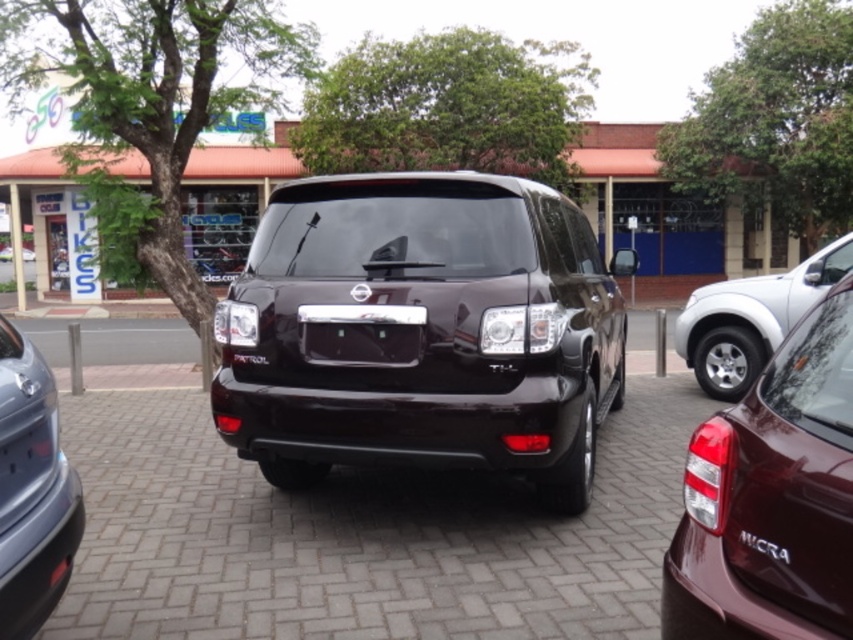
Question: Which point is farther to the camera?

Choices:
 (A) (64, 493)
 (B) (445, 456)
 (C) (802, 310)

Answer: (C)

Question: Which point is closer to the camera?

Choices:
 (A) (482, 394)
 (B) (828, 419)
 (C) (39, 596)
 (D) (815, 278)

Answer: (B)

Question: From the image, what is the correct spatial relationship of maroon glossy micra at lower right in relation to silver metallic pickup truck at right?

Choices:
 (A) above
 (B) below

Answer: (B)

Question: Which point is farther to the camera?

Choices:
 (A) maroon glossy micra at lower right
 (B) satin silver bumper at lower left

Answer: (B)

Question: Observing the image, what is the correct spatial positioning of maroon glossy micra at lower right in reference to satin silver bumper at lower left?

Choices:
 (A) left
 (B) right

Answer: (B)

Question: Can you confirm if maroon glossy micra at lower right is positioned to the right of silver metallic pickup truck at right?

Choices:
 (A) yes
 (B) no

Answer: (B)